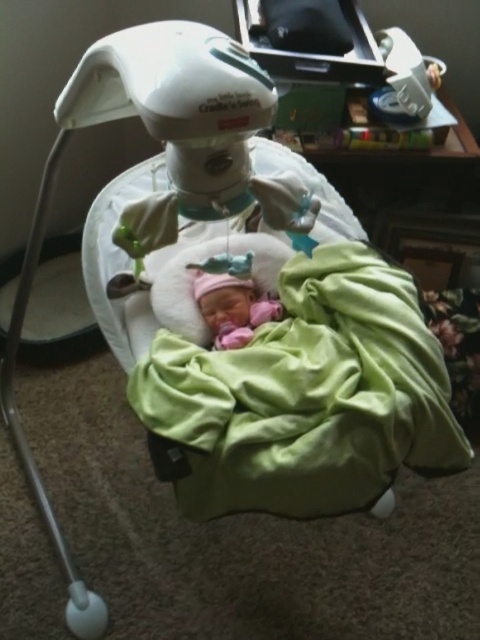
Question: Observing the image, what is the correct spatial positioning of green soft blanket at center in reference to pink fabric newborn at center?

Choices:
 (A) above
 (B) below

Answer: (B)

Question: In this image, where is green soft blanket at center located relative to pink fabric newborn at center?

Choices:
 (A) above
 (B) below

Answer: (B)

Question: Which object appears farthest from the camera in this image?

Choices:
 (A) green soft blanket at center
 (B) pink fabric newborn at center

Answer: (B)

Question: Which point appears farthest from the camera in this image?

Choices:
 (A) (223, 316)
 (B) (345, 369)

Answer: (A)

Question: Which of the following is the closest to the observer?

Choices:
 (A) pink fabric newborn at center
 (B) green soft blanket at center

Answer: (B)

Question: Can you confirm if green soft blanket at center is positioned to the left of pink fabric newborn at center?

Choices:
 (A) no
 (B) yes

Answer: (A)